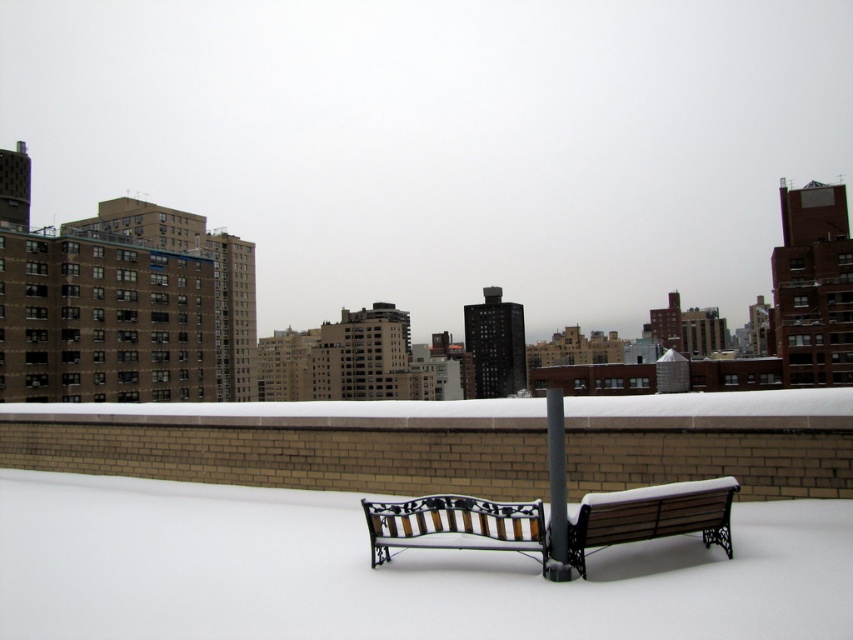
Question: Which of these objects is positioned closest to the wooden-patterned bench at center?

Choices:
 (A) white fluffy snow at center
 (B) wooden bench at center

Answer: (B)

Question: Is wooden bench at center bigger than black metal pole at center?

Choices:
 (A) no
 (B) yes

Answer: (A)

Question: Does wooden bench at center come behind wooden-patterned bench at center?

Choices:
 (A) yes
 (B) no

Answer: (B)

Question: Which of the following is the farthest from the observer?

Choices:
 (A) wooden-patterned bench at center
 (B) white fluffy snow at center

Answer: (A)

Question: Which of these objects is positioned closest to the black metal pole at center?

Choices:
 (A) wooden bench at center
 (B) white fluffy snow at center

Answer: (A)

Question: Is wooden-patterned bench at center below black metal pole at center?

Choices:
 (A) no
 (B) yes

Answer: (B)